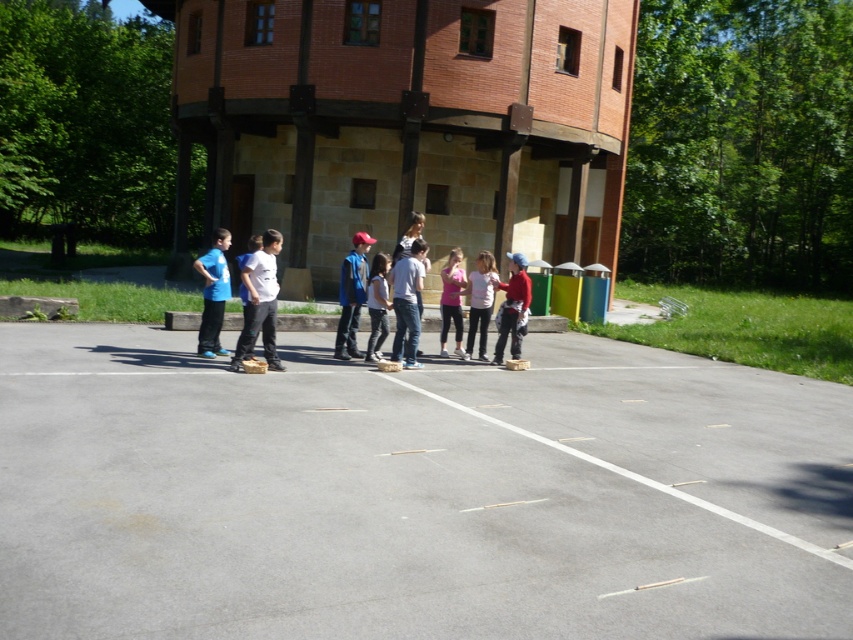
You are a construction worker who needs to place the matte red helmet at center on the asphalt at center. Given the size difference between them, will the helmet fit entirely on the asphalt?

The asphalt at center has a larger size compared to matte red helmet at center, so yes, the helmet will fit entirely on the asphalt.